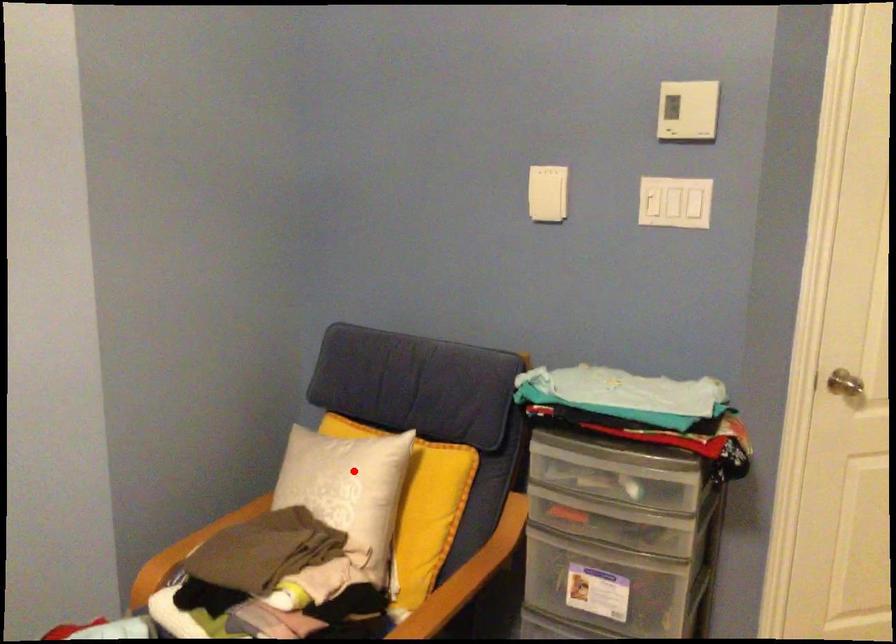
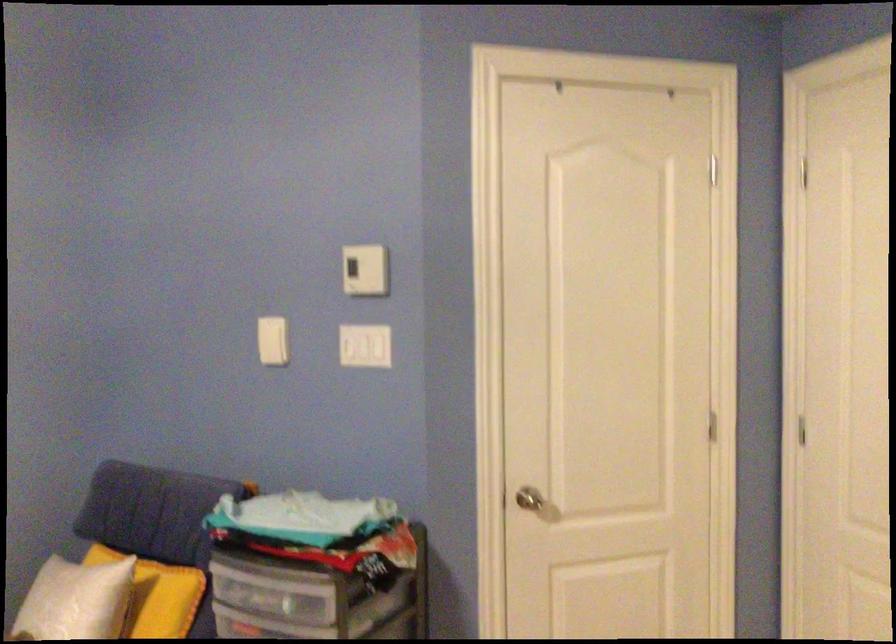
Question: A red point is marked in image1. In image2, is the corresponding 3D point closer to the camera or farther? Reply with the corresponding letter.

Choices:
 (A) The corresponding 3D point is closer.
 (B) The corresponding 3D point is farther.

Answer: (B)